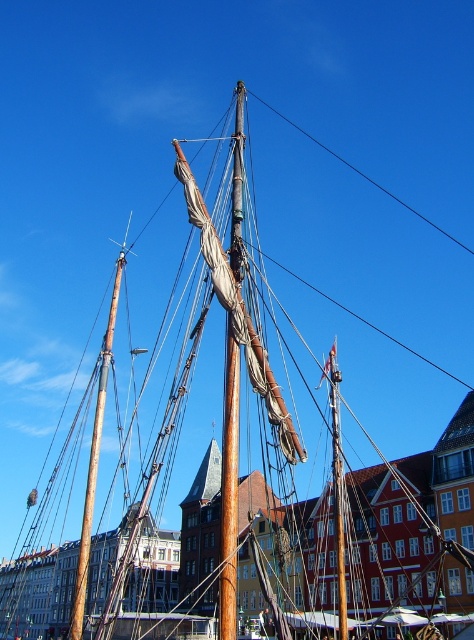
You are standing at the point labeled point [120,275] and want to move to the point labeled point [235,611]. Which direction should you move to get closer to the ship?

You should move forward because point [235,611] is closer to the viewer than point [120,275], so moving toward it would bring you closer to the ship.

You are a sailor trying to determine which mast is shorter between the wooden mast at center and the brown wood mast at upper center. Which one should you choose if you need to work on the shorter one?

The wooden mast at center has a lesser height compared to the brown wood mast at upper center, so you should choose the wooden mast at center for working on the shorter one.